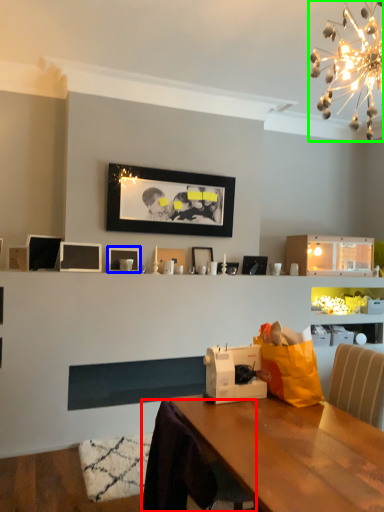
Question: Which object is the farthest from swivel chair (highlighted by a red box)? Choose among these: picture frame (highlighted by a blue box) or light fixture (highlighted by a green box).

Choices:
 (A) picture frame
 (B) light fixture

Answer: (B)